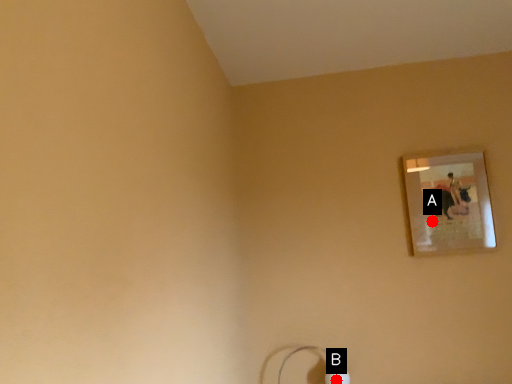
Question: Two points are circled on the image, labeled by A and B beside each circle. Which point is farther from the camera taking this photo?

Choices:
 (A) A is further
 (B) B is further

Answer: (A)